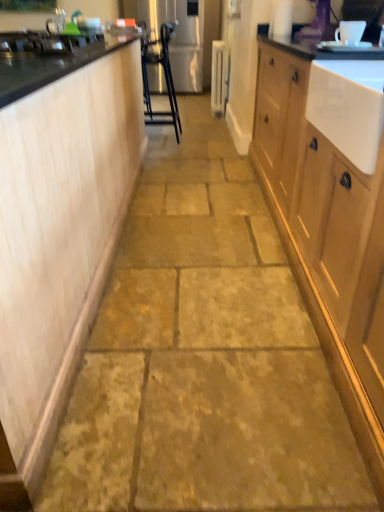
Question: Is metallic silver bar stool at center wider than wooden cabinet at right, which is counted as the 2th cabinetry, starting from the left?

Choices:
 (A) yes
 (B) no

Answer: (B)

Question: Can you confirm if metallic silver bar stool at center is taller than wooden cabinet at right, which is counted as the 2th cabinetry, starting from the left?

Choices:
 (A) no
 (B) yes

Answer: (B)

Question: Is metallic silver bar stool at center thinner than wooden cabinet at right, which is the first cabinetry from right to left?

Choices:
 (A) yes
 (B) no

Answer: (A)

Question: Is metallic silver bar stool at center placed right next to wooden cabinet at right, which is the first cabinetry from right to left?

Choices:
 (A) no
 (B) yes

Answer: (A)

Question: Can wooden cabinet at right, which is counted as the 2th cabinetry, starting from the left, be found inside metallic silver bar stool at center?

Choices:
 (A) yes
 (B) no

Answer: (B)

Question: Can you confirm if metallic silver bar stool at center is bigger than wooden cabinet at right, which is counted as the 2th cabinetry, starting from the left?

Choices:
 (A) no
 (B) yes

Answer: (A)

Question: Are natural stone floor at center and metallic silver bar stool at center beside each other?

Choices:
 (A) yes
 (B) no

Answer: (B)

Question: Is natural stone floor at center at the left side of metallic silver bar stool at center?

Choices:
 (A) no
 (B) yes

Answer: (A)

Question: Considering the relative sizes of natural stone floor at center and metallic silver bar stool at center in the image provided, is natural stone floor at center thinner than metallic silver bar stool at center?

Choices:
 (A) yes
 (B) no

Answer: (B)

Question: From a real-world perspective, is natural stone floor at center located higher than metallic silver bar stool at center?

Choices:
 (A) yes
 (B) no

Answer: (B)

Question: Is metallic silver bar stool at center at the back of natural stone floor at center?

Choices:
 (A) yes
 (B) no

Answer: (B)

Question: Is the position of natural stone floor at center more distant than that of metallic silver bar stool at center?

Choices:
 (A) no
 (B) yes

Answer: (A)

Question: Is white ceramic mug at upper center, the first appliance from the bottom, completely or partially outside of wooden cabinet at right, which is counted as the 2th cabinetry, starting from the left?

Choices:
 (A) yes
 (B) no

Answer: (A)